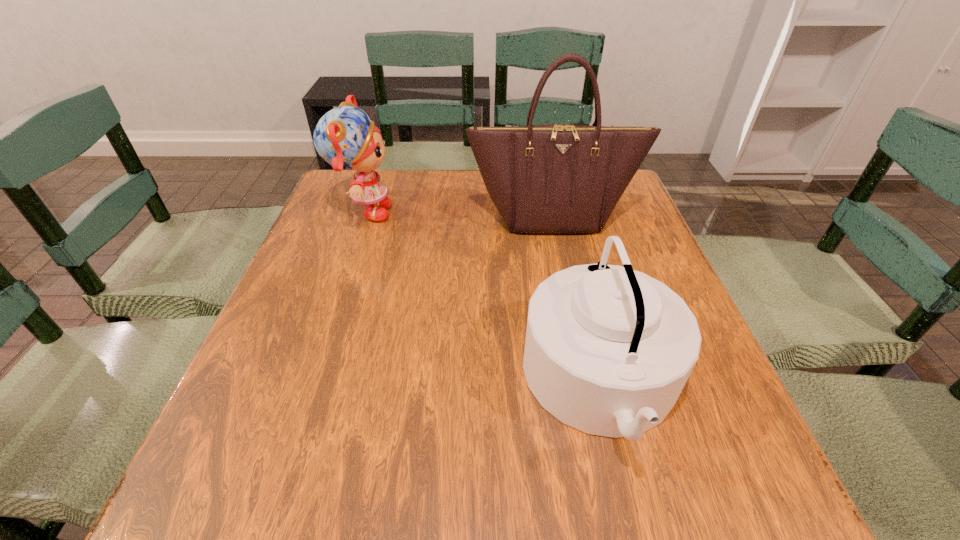
You are a GUI agent. You are given a task and a screenshot of the screen. Output one action in this format:
    pyautogui.click(x=<x>, y=<y>)
    Task: Click on the object at the near edge
    
    Given the screenshot: What is the action you would take?
    pyautogui.click(x=608, y=350)

I want to click on object at the left edge, so click(345, 138).

You are a GUI agent. You are given a task and a screenshot of the screen. Output one action in this format:
    pyautogui.click(x=<x>, y=<y>)
    Task: Click on the handbag at the right edge
    This screenshot has width=960, height=540.
    Given the screenshot: What is the action you would take?
    pyautogui.click(x=556, y=178)

Find the location of a particular element. The image size is (960, 540). kettle located at the right edge is located at coordinates (608, 350).

Locate an element on the screen. Image resolution: width=960 pixels, height=540 pixels. object located in the far left corner section of the desktop is located at coordinates (345, 138).

Locate an element on the screen. The image size is (960, 540). object that is at the far right corner is located at coordinates (556, 178).

Locate an element on the screen. Image resolution: width=960 pixels, height=540 pixels. object located at the near right corner is located at coordinates (608, 350).

Where is `blank area at the far edge`? This screenshot has width=960, height=540. blank area at the far edge is located at coordinates (435, 183).

The height and width of the screenshot is (540, 960). Find the location of `vacant area at the left edge of the desktop`. vacant area at the left edge of the desktop is located at coordinates (300, 313).

Identify the location of vacant region at the right edge of the desktop. This screenshot has width=960, height=540. (687, 415).